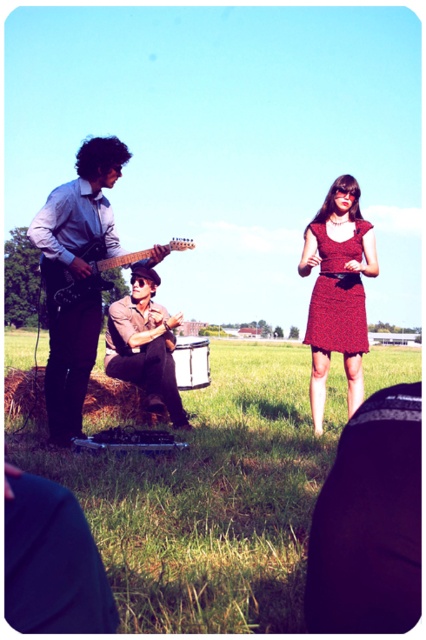
Can you confirm if matte red dress at center is positioned to the left of brown leather jacket at center?

Incorrect, matte red dress at center is not on the left side of brown leather jacket at center.

Is point (351, 378) positioned behind point (112, 369)?

No.

Locate an element on the screen. matte red dress at center is located at coordinates (337, 291).

Is point (140, 326) farther from camera compared to point (186, 372)?

No, it is in front of (186, 372).

Who is more forward, (137,305) or (180,378)?

Positioned in front is point (137,305).

Between point (127, 301) and point (175, 376), which one is positioned in front?

Positioned in front is point (127, 301).

The height and width of the screenshot is (640, 426). Find the location of `brown leather jacket at center`. brown leather jacket at center is located at coordinates (144, 344).

Who is positioned more to the right, shiny black guitar at left or red textured dress at center?

From the viewer's perspective, red textured dress at center appears more on the right side.

Does shiny black guitar at left appear over red textured dress at center?

Yes, shiny black guitar at left is above red textured dress at center.

Where is `shiny black guitar at left`? shiny black guitar at left is located at coordinates (75, 276).

I want to click on shiny black guitar at left, so click(75, 276).